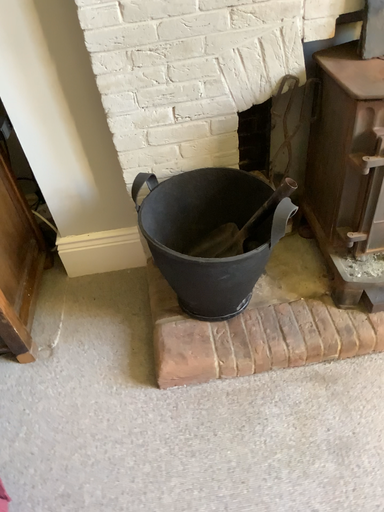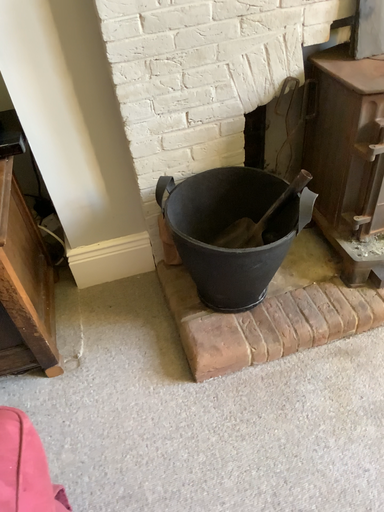
Question: How did the camera likely rotate when shooting the video?

Choices:
 (A) rotated right
 (B) rotated left

Answer: (A)